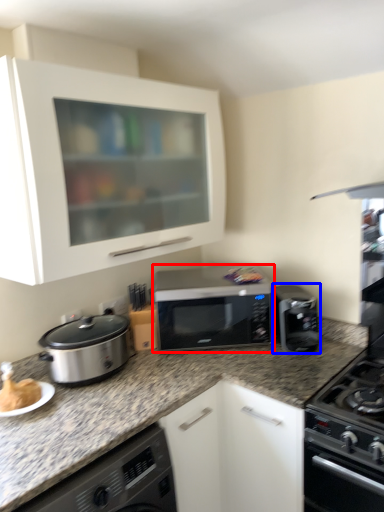
Question: Which of the following is the farthest to the observer, microwave oven (highlighted by a red box) or kitchen appliance (highlighted by a blue box)?

Choices:
 (A) microwave oven
 (B) kitchen appliance

Answer: (A)